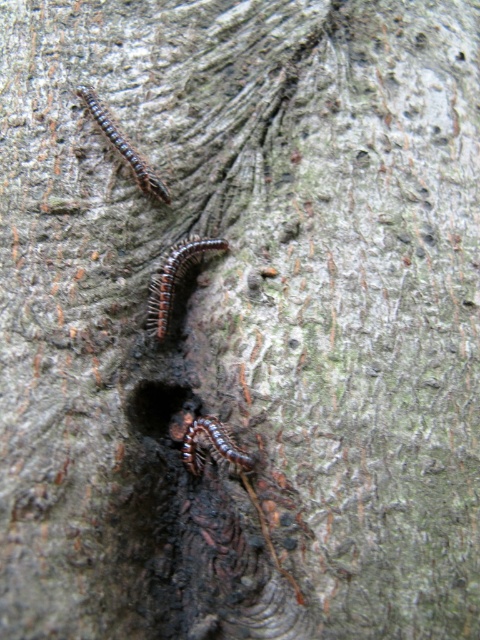
Question: Which of the following is the closest to the observer?

Choices:
 (A) [213, 250]
 (B) [182, 436]
 (C) [113, 120]

Answer: (B)

Question: Which of the following is the farthest from the observer?

Choices:
 (A) brown shiny centipede at center
 (B) brown scaly centipede at center

Answer: (B)

Question: Does brown shiny centipede at center appear over brown scaly centipede at upper left?

Choices:
 (A) no
 (B) yes

Answer: (A)

Question: Is brown scaly centipede at center positioned behind brown shiny centipede at center?

Choices:
 (A) yes
 (B) no

Answer: (A)

Question: Considering the relative positions of brown scaly centipede at center and brown scaly centipede at upper left in the image provided, where is brown scaly centipede at center located with respect to brown scaly centipede at upper left?

Choices:
 (A) right
 (B) left

Answer: (A)

Question: Which object is closer to the camera taking this photo?

Choices:
 (A) brown scaly centipede at center
 (B) brown scaly centipede at upper left
 (C) brown shiny centipede at center

Answer: (C)